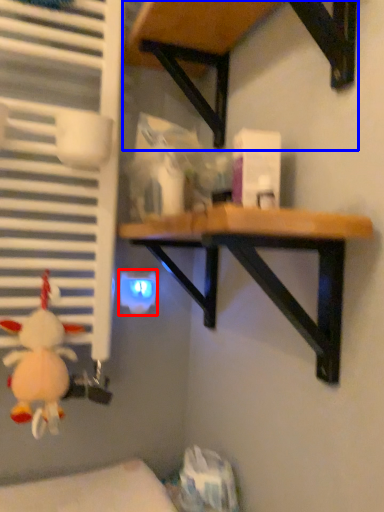
Question: Which point is further to the camera, electric outlet (highlighted by a red box) or table (highlighted by a blue box)?

Choices:
 (A) electric outlet
 (B) table

Answer: (A)